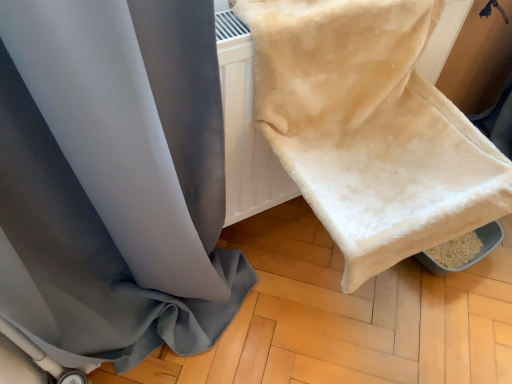
The height and width of the screenshot is (384, 512). Find the location of `free location to the right of satin gray curtain at upper left`. free location to the right of satin gray curtain at upper left is located at coordinates (316, 328).